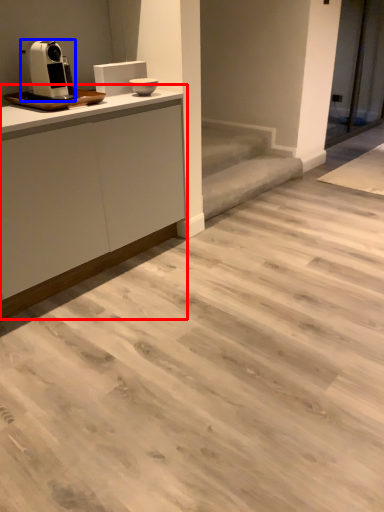
Question: Which object appears farthest to the camera in this image, cabinetry (highlighted by a red box) or home appliance (highlighted by a blue box)?

Choices:
 (A) cabinetry
 (B) home appliance

Answer: (B)